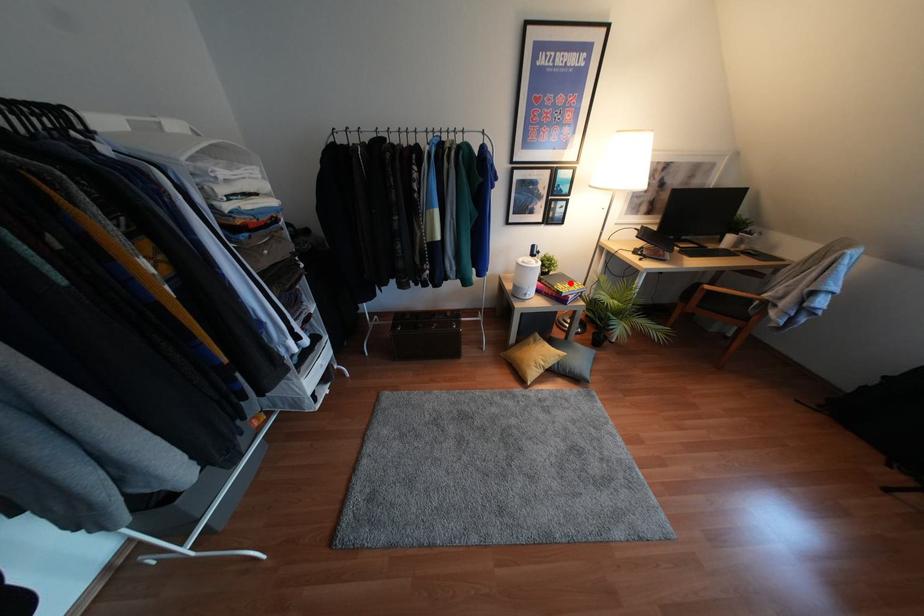
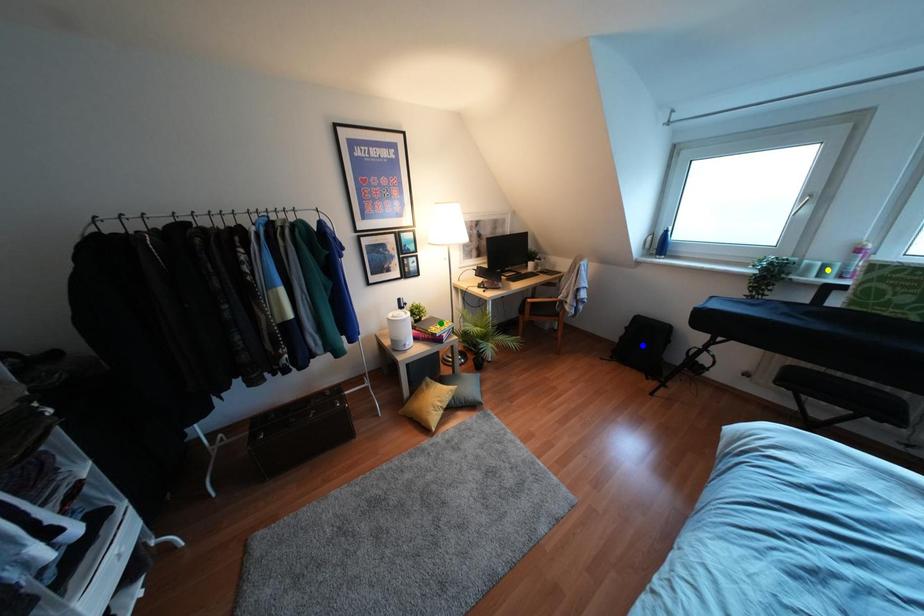
Question: I am providing you with two images of the same scene from different viewpoints. A red point is marked on the first image. You are given multiple points on the second image. Which point in image 2 represents the same 3d spot as the red point in image 1?

Choices:
 (A) green point
 (B) blue point
 (C) yellow point

Answer: (A)